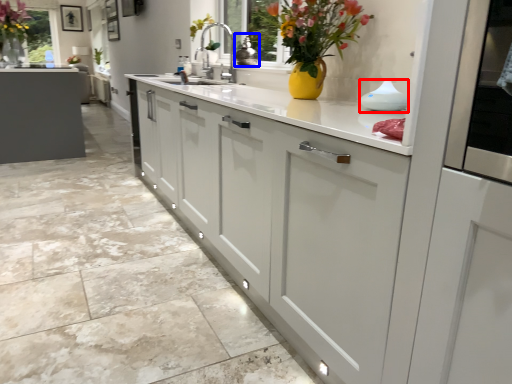
Question: Which of the following is the closest to the observer, appliance (highlighted by a red box) or appliance (highlighted by a blue box)?

Choices:
 (A) appliance
 (B) appliance

Answer: (A)